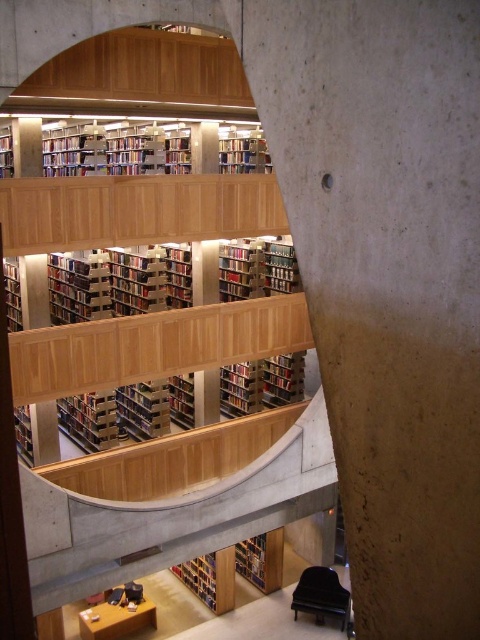
Question: Is wooden bookcase at upper center wider than wooden bookshelf at lower center?

Choices:
 (A) yes
 (B) no

Answer: (B)

Question: Considering the real-world distances, which object is farthest from the hardcover book at lower center?

Choices:
 (A) wooden bookcase at upper center
 (B) wooden bookshelf at lower center

Answer: (A)

Question: Which point is farther from the camera taking this photo?

Choices:
 (A) (262, 588)
 (B) (215, 605)

Answer: (A)

Question: Which point appears closest to the camera in this image?

Choices:
 (A) (264, 536)
 (B) (79, 444)
 (C) (211, 588)

Answer: (C)

Question: Can you confirm if wooden bookcase at upper center is positioned to the right of hardcover book at lower center?

Choices:
 (A) no
 (B) yes

Answer: (A)

Question: Does wooden bookshelf at lower center have a larger size compared to hardcover book at lower center?

Choices:
 (A) yes
 (B) no

Answer: (A)